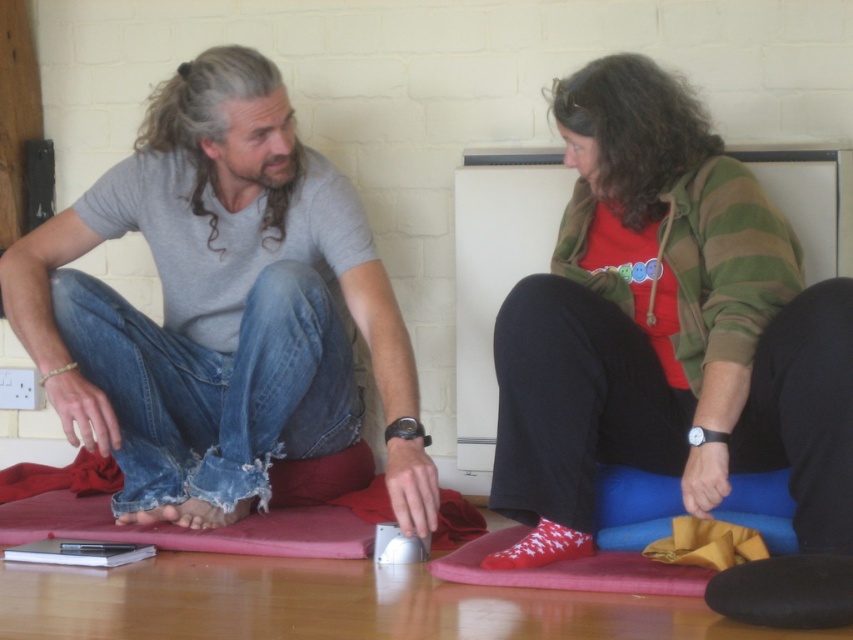
Based on the coordinates provided, what object is located at point (x=219, y=308) in the image?

The matte gray t shirt at center is located at point (x=219, y=308).